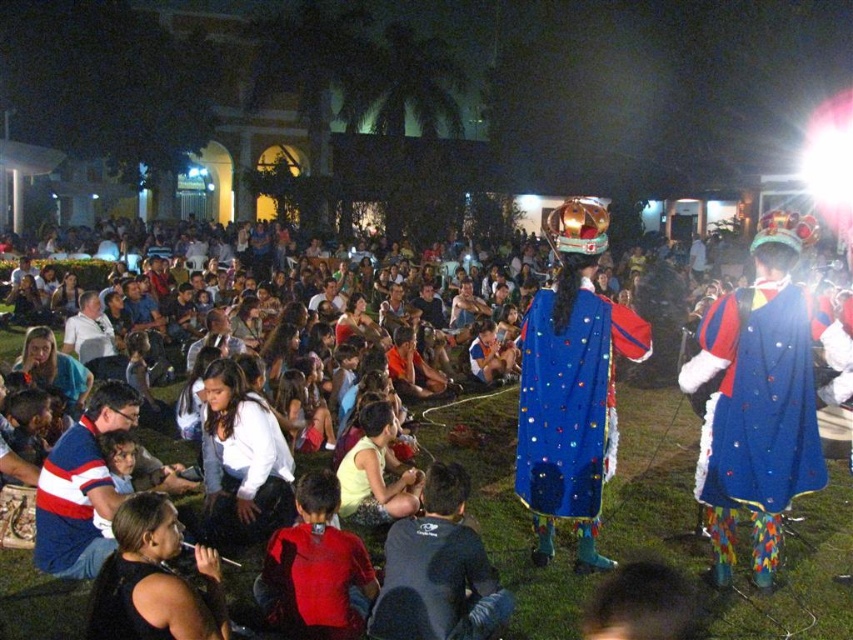
Question: Can you confirm if shiny blue cape at center is positioned above black fabric shirt at lower left?

Choices:
 (A) no
 (B) yes

Answer: (B)

Question: Does blue sequined costume at center appear on the left side of yellow fabric dress at center?

Choices:
 (A) no
 (B) yes

Answer: (B)

Question: Which object is the closest to the black fabric shirt at lower left?

Choices:
 (A) striped cotton shirt at lower left
 (B) shiny blue cape at center

Answer: (A)

Question: Among these objects, which one is nearest to the camera?

Choices:
 (A) blue sequined cape at center
 (B) dark gray fabric shirt at lower center

Answer: (B)

Question: Does red fleece jacket at center have a lesser width compared to white matte shirt at center?

Choices:
 (A) no
 (B) yes

Answer: (B)

Question: Which point is farther from the camera taking this photo?

Choices:
 (A) (177, 612)
 (B) (320, 634)
 (C) (463, 500)

Answer: (C)